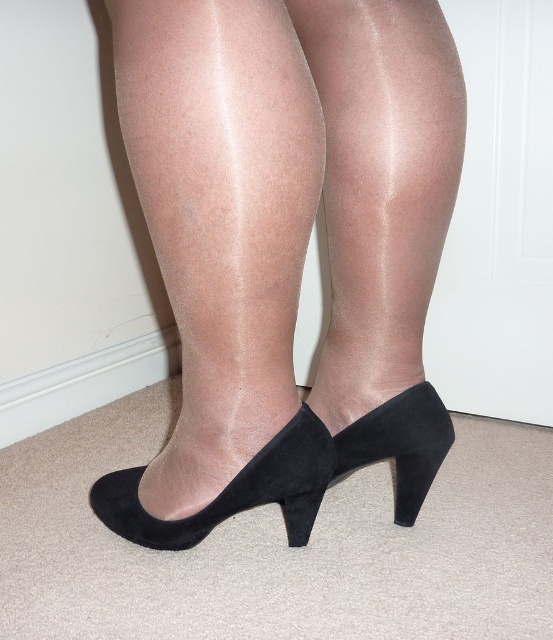
Question: Which point appears farthest from the camera in this image?

Choices:
 (A) (310, 506)
 (B) (228, 36)
 (C) (340, 356)

Answer: (C)

Question: Can you confirm if suede-like black high-heeled shoe at center is positioned above suede black high-heeled shoe at lower center?

Choices:
 (A) yes
 (B) no

Answer: (A)

Question: Does satin smooth pantyhose at center appear under suede black high-heeled shoe at lower center?

Choices:
 (A) no
 (B) yes

Answer: (A)

Question: Which of the following is the farthest from the observer?

Choices:
 (A) (247, 474)
 (B) (337, 177)

Answer: (B)

Question: Does suede-like black high-heeled shoe at center have a greater width compared to suede black high-heeled shoe at center?

Choices:
 (A) no
 (B) yes

Answer: (B)

Question: Among these points, which one is nearest to the camera?

Choices:
 (A) (383, 355)
 (B) (309, 408)
 (C) (274, 67)

Answer: (C)